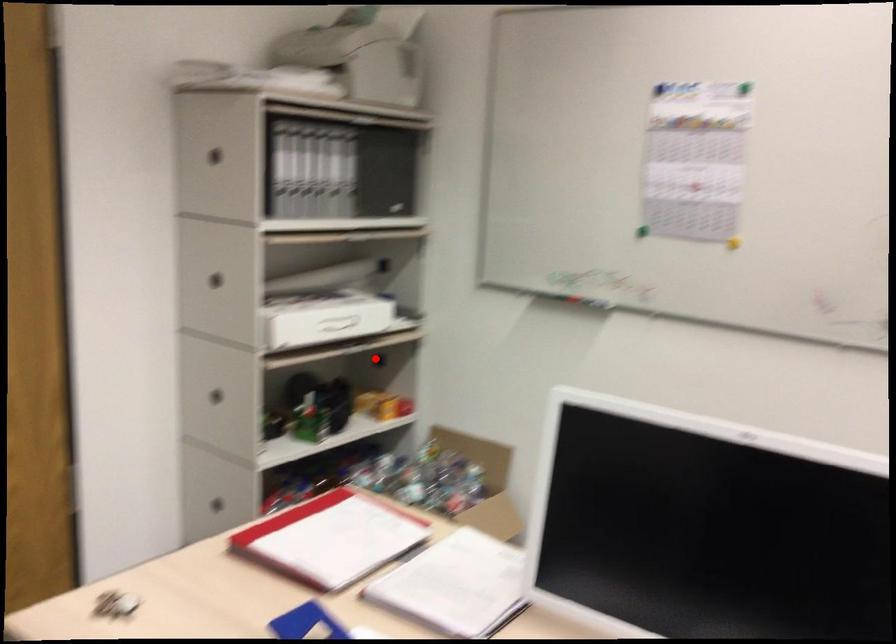
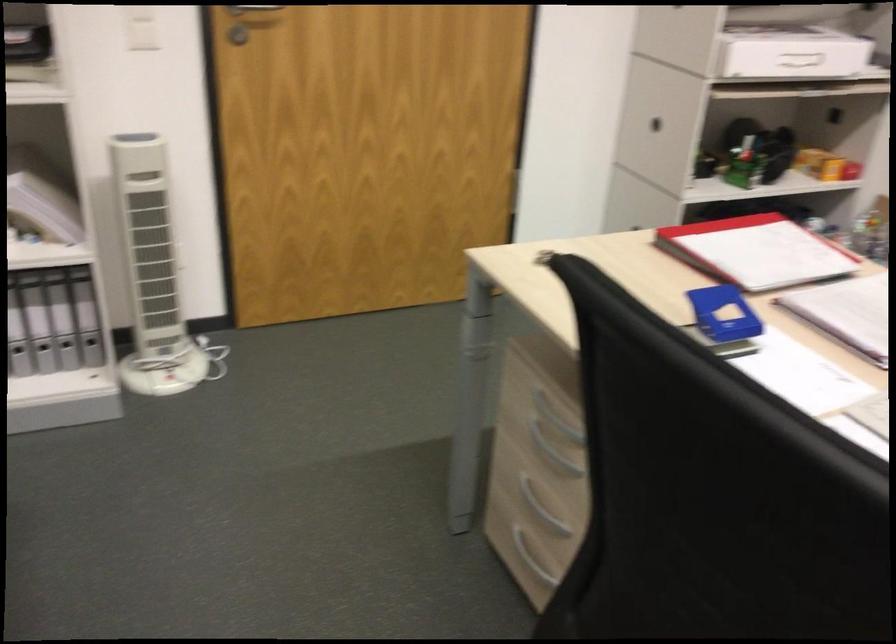
Question: I am providing you with two images of the same scene from different viewpoints. In image1, a red point is highlighted. Considering the same 3D point in image2, which of the following is correct?

Choices:
 (A) It is closer
 (B) It is farther

Answer: (A)